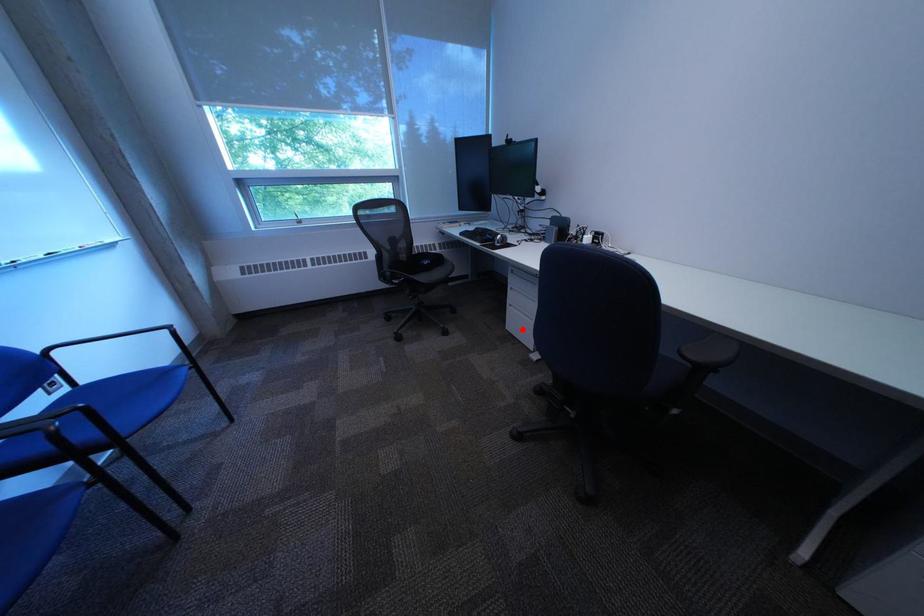
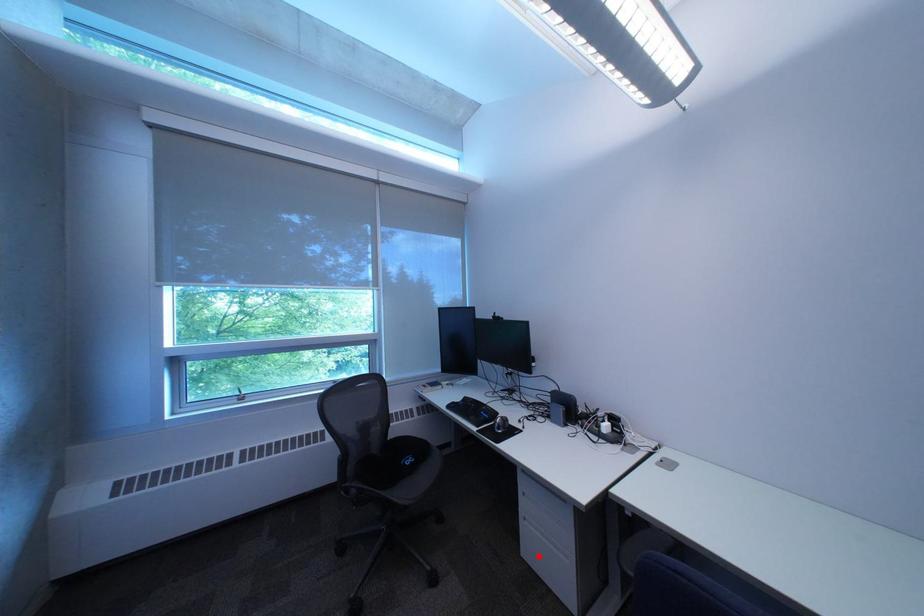
I am providing you with two images of the same scene from different viewpoints. A red point is marked on the first image and another point is marked on the second image. Does the point marked in image1 correspond to the same location as the one in image2?

Yes